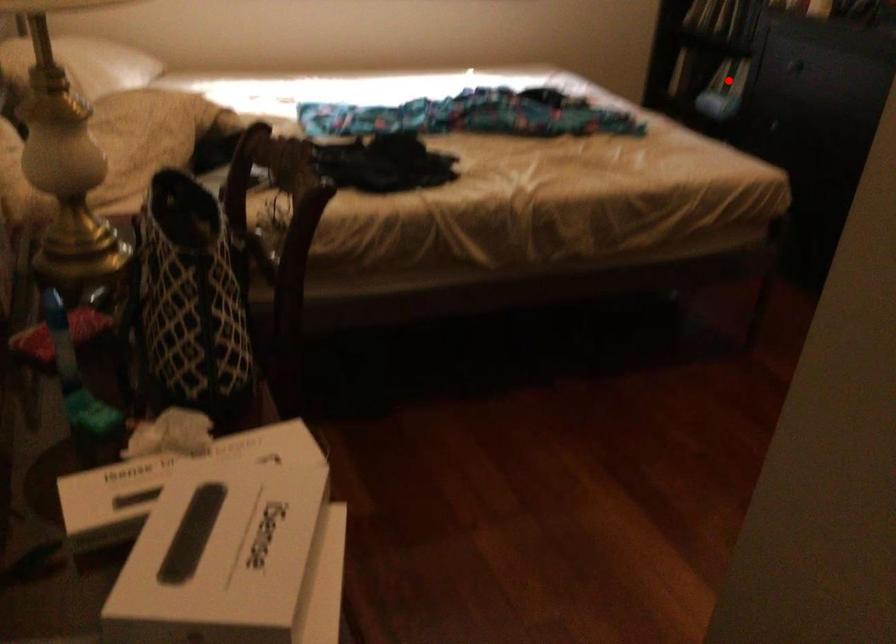
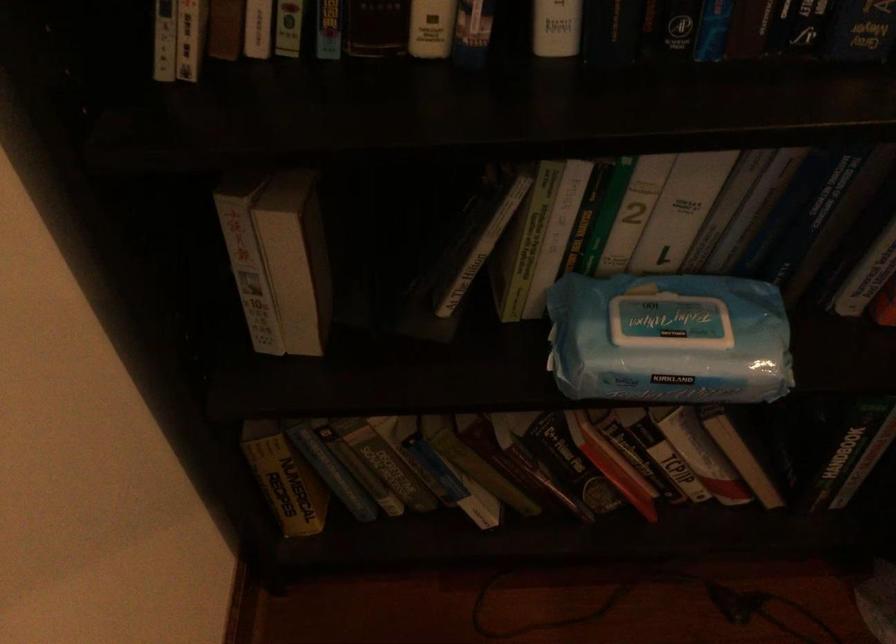
In the second image, find the point that corresponds to the highlighted location in the first image.

(668, 339)